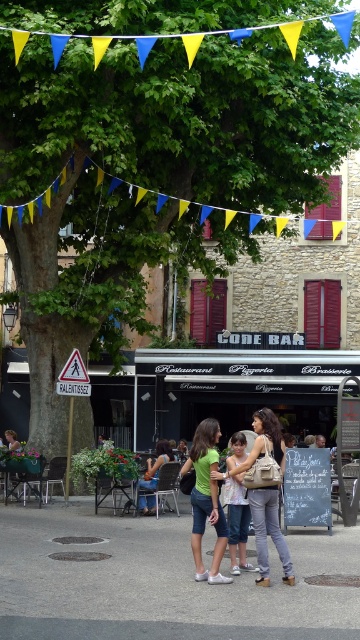
Question: Which point is closer to the camera taking this photo?

Choices:
 (A) (150, 499)
 (B) (198, 529)

Answer: (B)

Question: Can you confirm if matte beige handbag at center is smaller than white cotton shirt at center?

Choices:
 (A) yes
 (B) no

Answer: (A)

Question: Does green cotton shirt at center appear over white cotton shirt at center?

Choices:
 (A) no
 (B) yes

Answer: (A)

Question: Observing the image, what is the correct spatial positioning of black canvas food truck at center in reference to green cotton shirt at center?

Choices:
 (A) left
 (B) right

Answer: (A)

Question: Which of the following is the closest to the observer?

Choices:
 (A) white cotton shirt at center
 (B) denim shorts at center

Answer: (A)

Question: Which of the following is the farthest from the observer?

Choices:
 (A) pyautogui.click(x=299, y=394)
 (B) pyautogui.click(x=240, y=528)
 (C) pyautogui.click(x=261, y=515)
 (D) pyautogui.click(x=199, y=528)

Answer: (A)